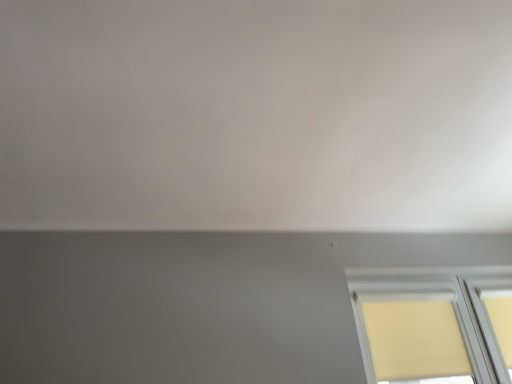
Image resolution: width=512 pixels, height=384 pixels. What are the coordinates of `white matte wall at upper center` in the screenshot? It's located at (256, 114).

What is the approximate width of white matte wall at upper center?

3.26 meters.

The height and width of the screenshot is (384, 512). What do you see at coordinates (256, 114) in the screenshot? I see `white matte wall at upper center` at bounding box center [256, 114].

What do you see at coordinates (434, 326) in the screenshot? Image resolution: width=512 pixels, height=384 pixels. I see `beige fabric window at lower right` at bounding box center [434, 326].

Image resolution: width=512 pixels, height=384 pixels. What are the coordinates of `beige fabric window at lower right` in the screenshot? It's located at (434, 326).

What is the approximate height of beige fabric window at lower right?

56.65 centimeters.

Where is `white matte wall at upper center`? The height and width of the screenshot is (384, 512). white matte wall at upper center is located at coordinates (256, 114).

From the picture: Which is more to the left, beige fabric window at lower right or white matte wall at upper center?

white matte wall at upper center.

Is beige fabric window at lower right closer to the viewer compared to white matte wall at upper center?

No, it is behind white matte wall at upper center.

Which is less distant, (367,324) or (425,79)?

The point (425,79) is more forward.

From the image's perspective, who appears lower, beige fabric window at lower right or white matte wall at upper center?

beige fabric window at lower right, from the image's perspective.

From a real-world perspective, between beige fabric window at lower right and white matte wall at upper center, who is vertically lower?

beige fabric window at lower right.

Which object is wider, beige fabric window at lower right or white matte wall at upper center?

white matte wall at upper center is wider.

Can you confirm if beige fabric window at lower right is taller than white matte wall at upper center?

Indeed, beige fabric window at lower right has a greater height compared to white matte wall at upper center.

Who is smaller, beige fabric window at lower right or white matte wall at upper center?

beige fabric window at lower right is smaller.

Do you think beige fabric window at lower right is within white matte wall at upper center, or outside of it?

beige fabric window at lower right is outside white matte wall at upper center.

Based on the photo, is beige fabric window at lower right placed right next to white matte wall at upper center?

No, beige fabric window at lower right is not beside white matte wall at upper center.

Is beige fabric window at lower right turned away from white matte wall at upper center?

No.

How different are the orientations of beige fabric window at lower right and white matte wall at upper center in degrees?

92.1 degrees separate the facing orientations of beige fabric window at lower right and white matte wall at upper center.

The image size is (512, 384). What are the coordinates of `backdrop on the left of beige fabric window at lower right` in the screenshot? It's located at (256, 114).

Looking at this image, can you confirm if white matte wall at upper center is positioned to the right of beige fabric window at lower right?

In fact, white matte wall at upper center is to the left of beige fabric window at lower right.

Is white matte wall at upper center positioned behind beige fabric window at lower right?

No, white matte wall at upper center is closer to the camera.

Considering the points (224, 15) and (406, 353), which point is in front, point (224, 15) or point (406, 353)?

The point (224, 15) is in front.

From the image's perspective, which is above, white matte wall at upper center or beige fabric window at lower right?

white matte wall at upper center.

In the scene shown: From a real-world perspective, who is located lower, white matte wall at upper center or beige fabric window at lower right?

beige fabric window at lower right, from a real-world perspective.

Looking at this image, considering the sizes of white matte wall at upper center and beige fabric window at lower right in the image, is white matte wall at upper center wider or thinner than beige fabric window at lower right?

In the image, white matte wall at upper center appears to be wider than beige fabric window at lower right.

Based on the photo, who is taller, white matte wall at upper center or beige fabric window at lower right?

With more height is beige fabric window at lower right.

Can you confirm if white matte wall at upper center is smaller than beige fabric window at lower right?

Actually, white matte wall at upper center might be larger than beige fabric window at lower right.

Is white matte wall at upper center outside of beige fabric window at lower right?

white matte wall at upper center lies outside beige fabric window at lower right's area.

Are white matte wall at upper center and beige fabric window at lower right located far from each other?

Yes, white matte wall at upper center and beige fabric window at lower right are located far from each other.

Is white matte wall at upper center oriented away from beige fabric window at lower right?

No, white matte wall at upper center's orientation is not away from beige fabric window at lower right.

How many degrees apart are the facing directions of white matte wall at upper center and beige fabric window at lower right?

The facing directions of white matte wall at upper center and beige fabric window at lower right are 92.1 degrees apart.

In the scene shown: How far apart are white matte wall at upper center and beige fabric window at lower right?

white matte wall at upper center is 1.20 meters away from beige fabric window at lower right.

Identify the location of window below the white matte wall at upper center (from the image's perspective). (434, 326).

Identify the location of backdrop above the beige fabric window at lower right (from the image's perspective). This screenshot has width=512, height=384. (256, 114).

This screenshot has height=384, width=512. In the image, there is a white matte wall at upper center. In order to click on window below it (from the image's perspective) in this screenshot , I will do `click(434, 326)`.